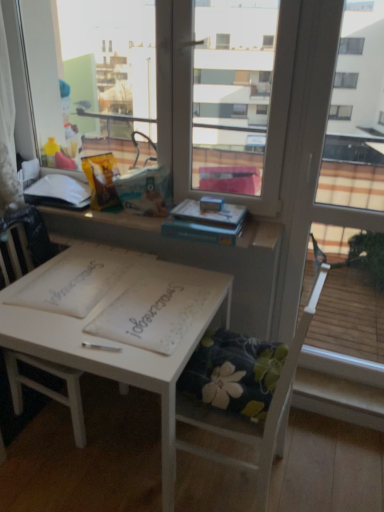
Identify the location of blank space situated above white paper notebook at center, which appears as the second notebook when viewed from the left (from a real-world perspective). (152, 310).